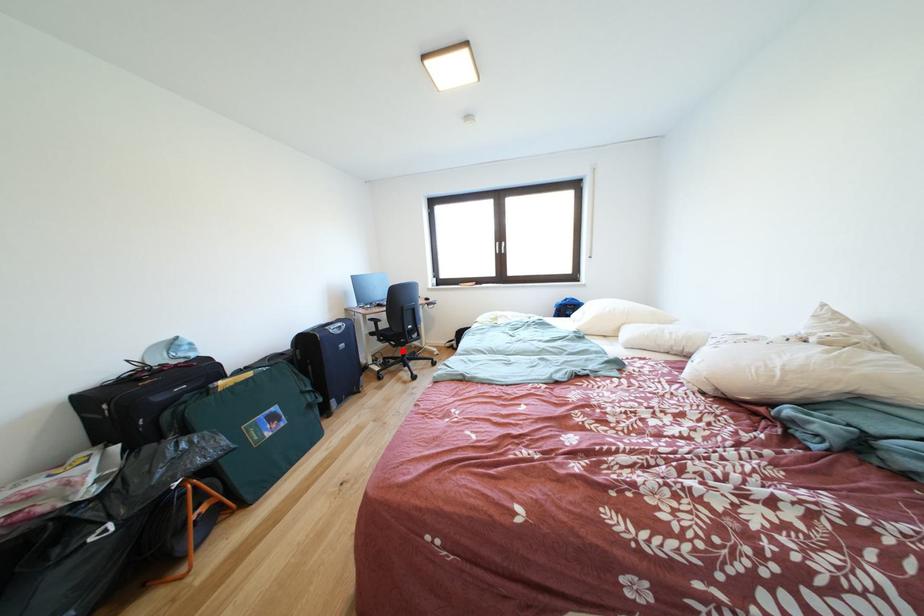
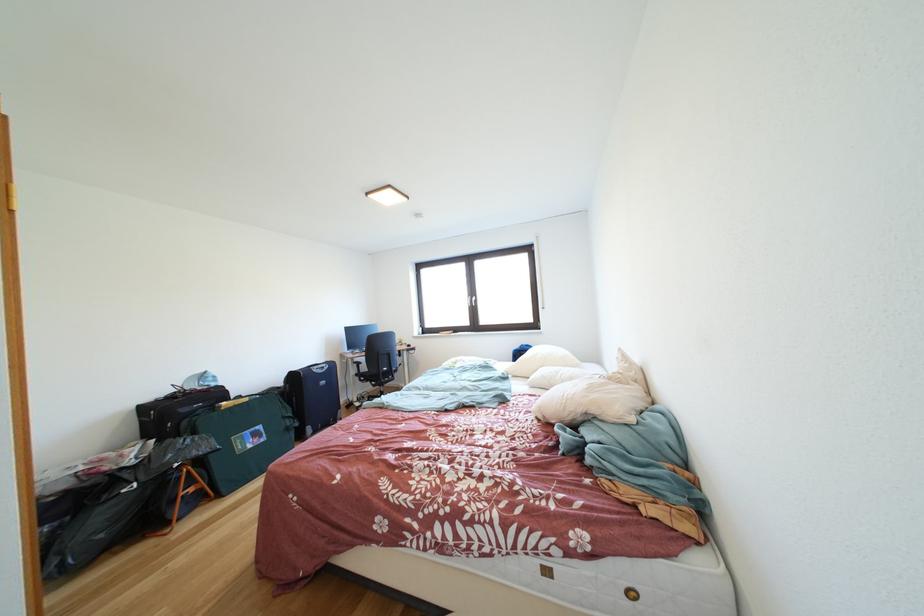
Question: I am providing you with two images of the same scene from different viewpoints. A red point is shown in image1. For the corresponding object point in image2, is it positioned nearer or farther from the camera?

Choices:
 (A) Nearer
 (B) Farther

Answer: (B)